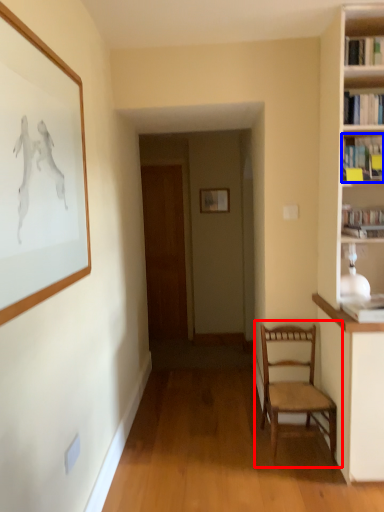
Question: Which object is further to the camera taking this photo, chair (highlighted by a red box) or book (highlighted by a blue box)?

Choices:
 (A) chair
 (B) book

Answer: (B)